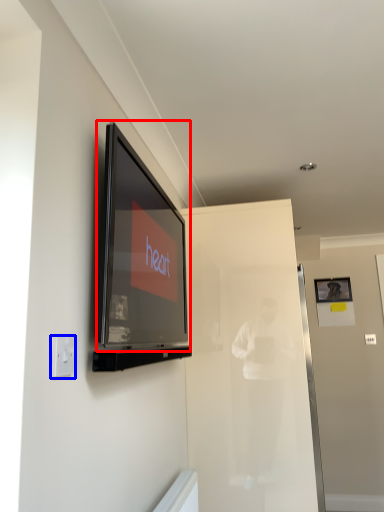
Question: Which object appears closest to the camera in this image, television (highlighted by a red box) or electric outlet (highlighted by a blue box)?

Choices:
 (A) television
 (B) electric outlet

Answer: (B)